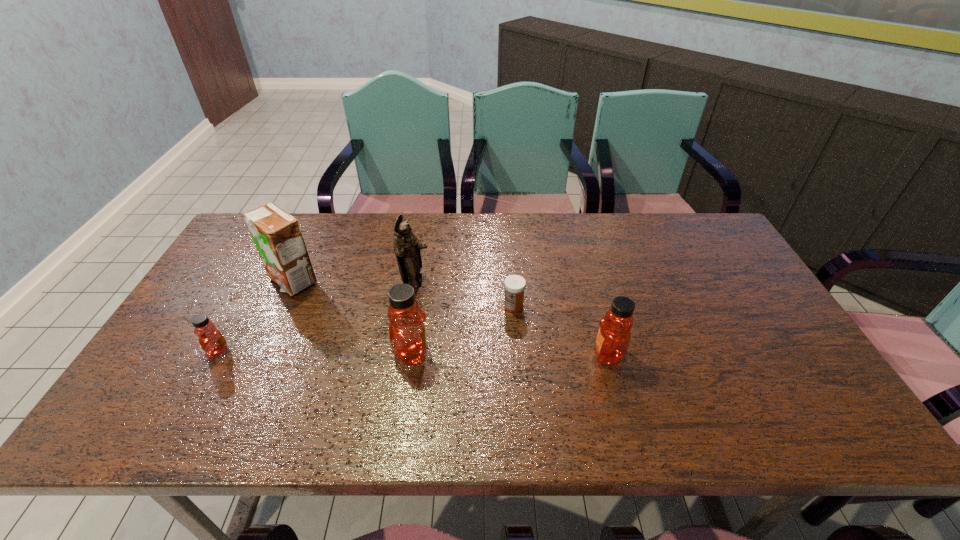
You are a GUI agent. You are given a task and a screenshot of the screen. Output one action in this format:
    pyautogui.click(x=<x>, y=<y>)
    Task: Click on the vacant area at the near edge
    Image resolution: width=960 pixels, height=540 pixels.
    Given the screenshot: What is the action you would take?
    pyautogui.click(x=732, y=387)

Image resolution: width=960 pixels, height=540 pixels. In order to click on free space at the left edge of the desktop in this screenshot , I will do [226, 282].

Identify the location of vacant space at the right edge of the desktop. The height and width of the screenshot is (540, 960). (765, 320).

At what (x,y) coordinates should I click in order to perform the action: click on vacant space at the far left corner of the desktop. Please return your answer as a coordinate pair (x, y). Looking at the image, I should click on (243, 230).

At what (x,y) coordinates should I click in order to perform the action: click on vacant area at the near left corner. Please return your answer as a coordinate pair (x, y). Looking at the image, I should click on (188, 392).

The image size is (960, 540). Find the location of `vacant space at the far right corner`. vacant space at the far right corner is located at coordinates (707, 212).

Where is `vacant space at the near right corner of the desktop`? The height and width of the screenshot is (540, 960). vacant space at the near right corner of the desktop is located at coordinates (787, 396).

Locate an element on the screen. The image size is (960, 540). vacant area between the third farthest object and the second honey from right to left is located at coordinates (463, 329).

Where is `free space between the rightmost object and the carton`? This screenshot has height=540, width=960. free space between the rightmost object and the carton is located at coordinates (450, 318).

You are a GUI agent. You are given a task and a screenshot of the screen. Output one action in this format:
    pyautogui.click(x=<x>, y=<y>)
    Task: Click on the free space between the medicine and the rightmost honey
    The width and height of the screenshot is (960, 540).
    Given the screenshot: What is the action you would take?
    pyautogui.click(x=561, y=330)